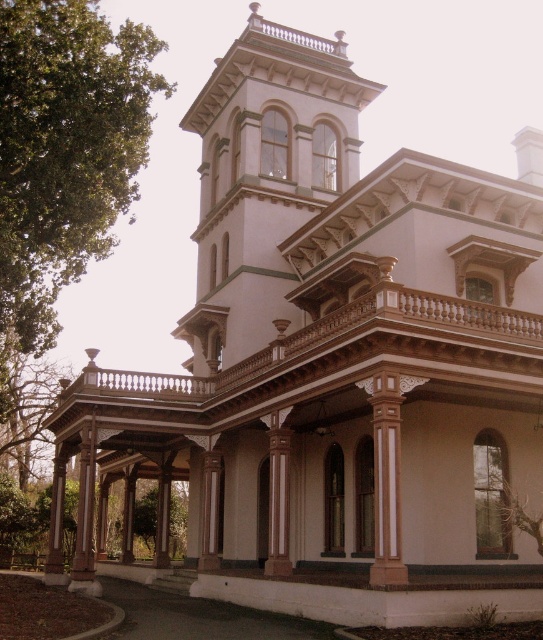
You are standing on the porch of the Victorian house and notice two points marked on the facade. The first point is at coordinates point (225, 317) and the second is at point (497, 371). Which point is closer to the roofline?

Point (497, 371) is closer to the roofline because it is higher up on the facade compared to point (225, 317), which is positioned lower and behind it.

You are an architect planning to install a new decorative element on the house. You have two options to choose from. The first option is to place a wider decorative element on the white painted wood bell tower at upper center. The second option is to place a narrower decorative element on the wooden carved balcony at center. Based on the house structure, which option would be more appropriate?

The white painted wood bell tower at upper center is thinner than the wooden carved balcony at center. Therefore, placing a wider decorative element on the bell tower would be more appropriate as it can accommodate the wider element without overwhelming the structure, while the balcony being wider can also handle a narrower one but the first option is better.

You are a window washer standing on the wooden carved balcony at center. You need to reach the white painted wood bell tower at upper center to clean its windows. Given that your ladder can extend up to 15 meters, will you be able to reach the bell tower from your current position on the balcony?

The white painted wood bell tower at upper center and wooden carved balcony at center are 15.33 meters apart from each other. Since the ladder can only extend up to 15 meters, you will not be able to reach the bell tower from the balcony with the current ladder length.